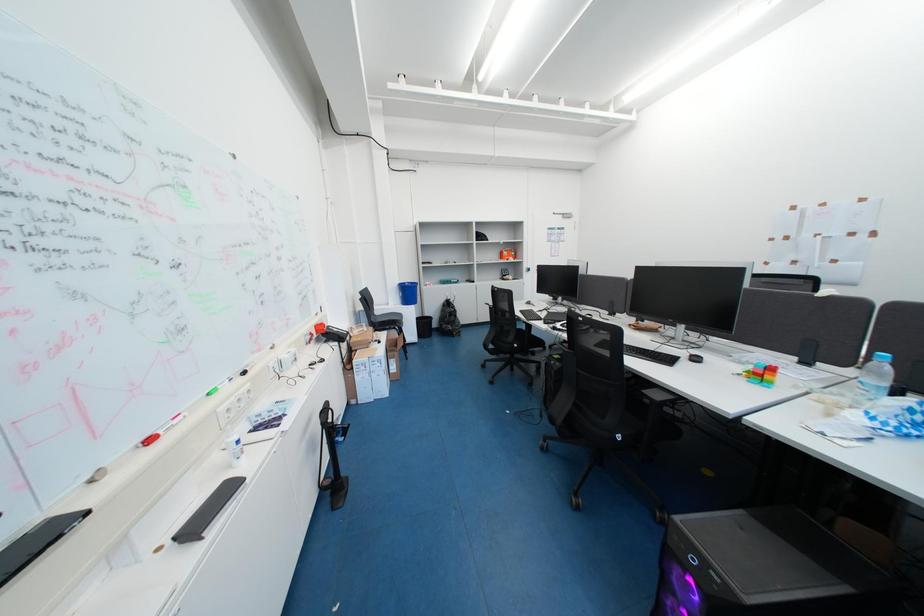
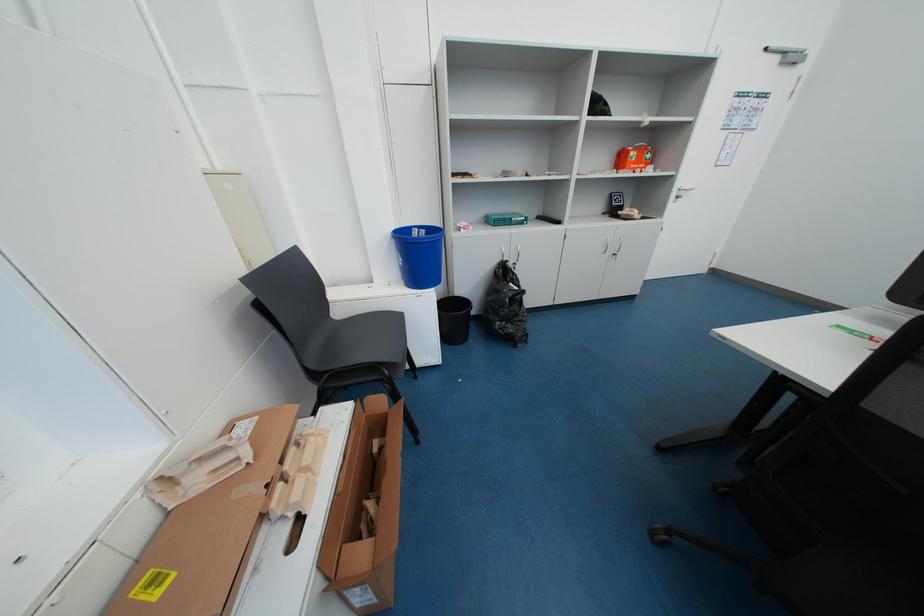
Question: What movement of the cameraman would produce the second image?

Choices:
 (A) Left
 (B) Right
 (C) Forward
 (D) Backward

Answer: (C)